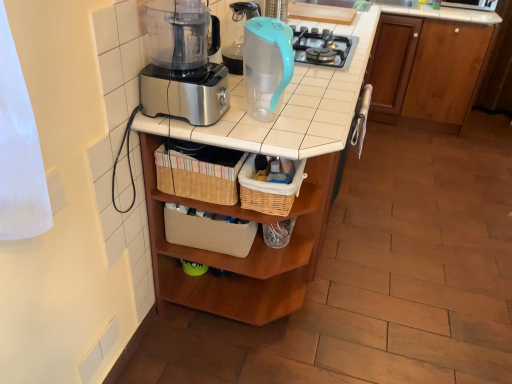
Question: Is woven wicker basket at center, which appears as the second basket when viewed from the left, wider or thinner than wooden table at center?

Choices:
 (A) thin
 (B) wide

Answer: (A)

Question: From a real-world perspective, is woven wicker basket at center, which appears as the second basket when viewed from the left, physically located above or below wooden table at center?

Choices:
 (A) above
 (B) below

Answer: (A)

Question: Considering the real-world distances, which object is farthest from the brown wood cabinet at upper right?

Choices:
 (A) wooden table at center
 (B) teal plastic pitcher at upper center
 (C) woven straw basket at center, the first basket from the left
 (D) woven wicker basket at center, arranged as the first basket when viewed from the right

Answer: (C)

Question: Which object is positioned farthest from the wooden table at center?

Choices:
 (A) woven straw basket at center, arranged as the second basket when viewed from the right
 (B) woven wicker basket at center, which appears as the second basket when viewed from the left
 (C) teal plastic pitcher at upper center
 (D) brown wood cabinet at upper right

Answer: (D)